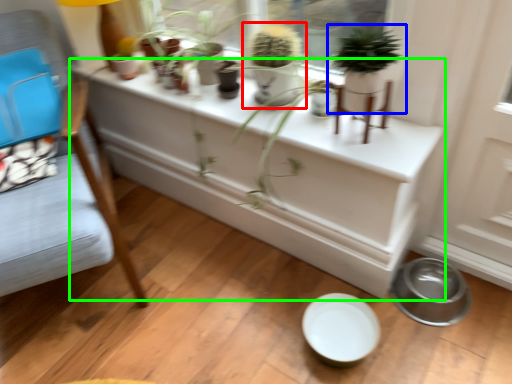
Question: Which is nearer to the houseplant (highlighted by a red box)? houseplant (highlighted by a blue box) or table (highlighted by a green box).

Choices:
 (A) houseplant
 (B) table

Answer: (A)